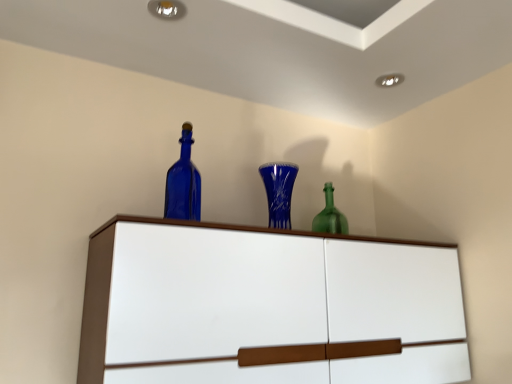
Question: Should I look upward or downward to see white glossy cupboard at upper center?

Choices:
 (A) down
 (B) up

Answer: (A)

Question: Considering the relative positions of white glossy cupboard at upper center and blue glass bottle at upper center in the image provided, is white glossy cupboard at upper center to the right of blue glass bottle at upper center from the viewer's perspective?

Choices:
 (A) no
 (B) yes

Answer: (B)

Question: Is white glossy cupboard at upper center oriented away from blue glass bottle at upper center?

Choices:
 (A) yes
 (B) no

Answer: (B)

Question: Would you say white glossy cupboard at upper center is outside blue glass bottle at upper center?

Choices:
 (A) yes
 (B) no

Answer: (A)

Question: Is white glossy cupboard at upper center closer to the viewer compared to blue glass bottle at upper center?

Choices:
 (A) no
 (B) yes

Answer: (B)

Question: Does white glossy cupboard at upper center have a smaller size compared to blue glass bottle at upper center?

Choices:
 (A) no
 (B) yes

Answer: (A)

Question: Does white glossy cupboard at upper center have a lesser height compared to blue glass bottle at upper center?

Choices:
 (A) no
 (B) yes

Answer: (A)

Question: Is white glossy cupboard at upper center at the back of blue glass vase at center?

Choices:
 (A) no
 (B) yes

Answer: (A)

Question: Considering the relative sizes of blue glass vase at center and white glossy cupboard at upper center in the image provided, is blue glass vase at center taller than white glossy cupboard at upper center?

Choices:
 (A) yes
 (B) no

Answer: (B)

Question: From a real-world perspective, is blue glass vase at center beneath white glossy cupboard at upper center?

Choices:
 (A) no
 (B) yes

Answer: (A)

Question: Is blue glass vase at center positioned behind white glossy cupboard at upper center?

Choices:
 (A) no
 (B) yes

Answer: (B)

Question: Is blue glass vase at center in front of white glossy cupboard at upper center?

Choices:
 (A) yes
 (B) no

Answer: (B)

Question: Considering the relative sizes of blue glass vase at center and white glossy cupboard at upper center in the image provided, is blue glass vase at center wider than white glossy cupboard at upper center?

Choices:
 (A) yes
 (B) no

Answer: (B)

Question: Is there a large distance between blue glass bottle at upper center and blue glass vase at center?

Choices:
 (A) yes
 (B) no

Answer: (B)